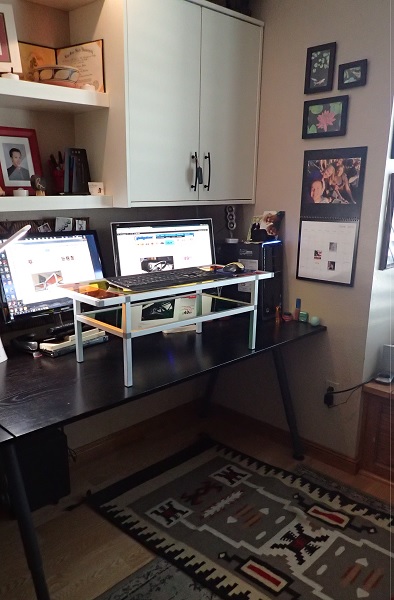
I want to click on calendar, so click(342, 240).